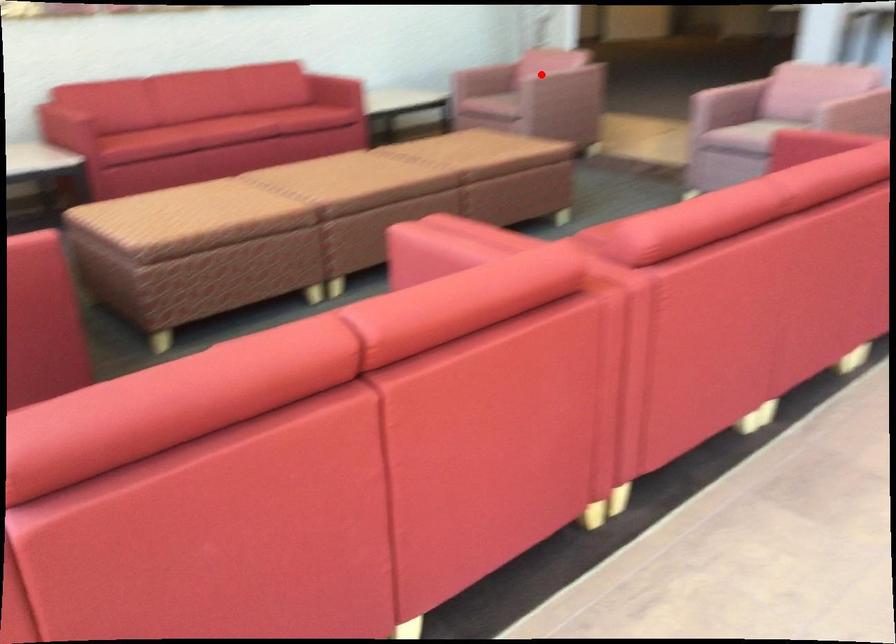
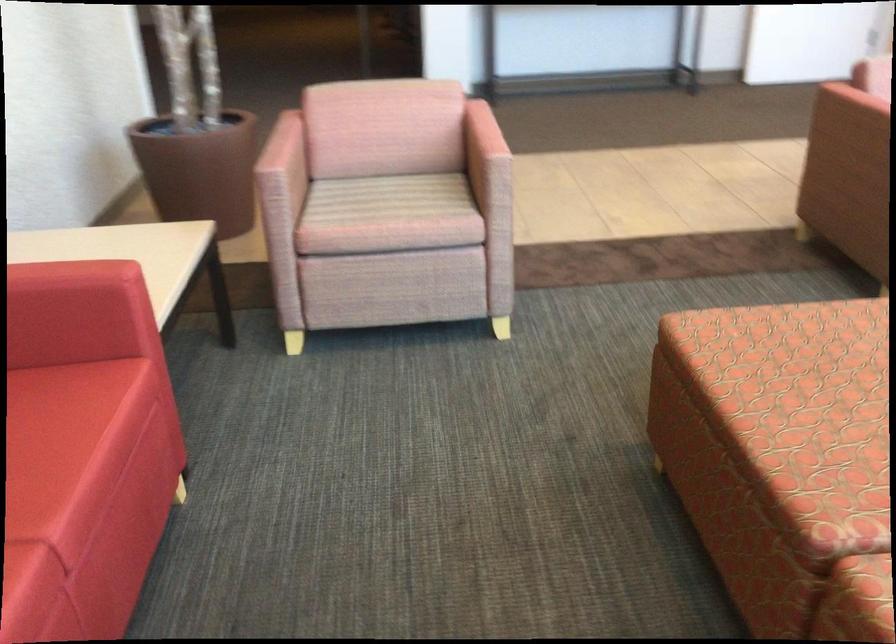
Question: I am providing you with two images of the same scene from different viewpoints. Image1 has a red point marked. In image2, the corresponding 3D location appears at what relative position? Reply with the corresponding letter.

Choices:
 (A) Closer
 (B) Farther

Answer: (A)